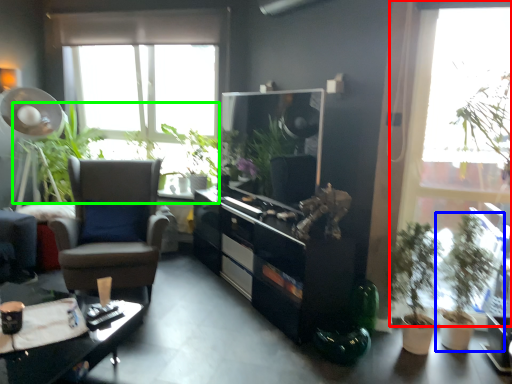
Question: Based on their relative distances, which object is farther from window (highlighted by a red box)? Choose from houseplant (highlighted by a blue box) and vegetation (highlighted by a green box).

Choices:
 (A) houseplant
 (B) vegetation

Answer: (B)